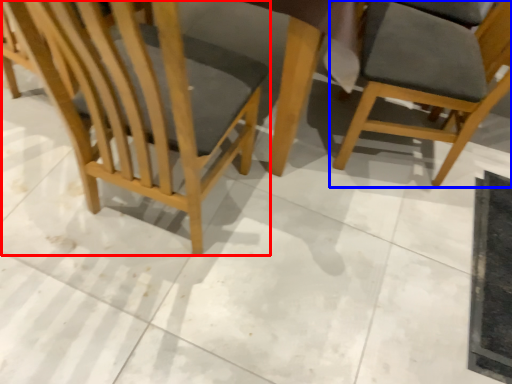
Question: Which object is further to the camera taking this photo, chair (highlighted by a red box) or chair (highlighted by a blue box)?

Choices:
 (A) chair
 (B) chair

Answer: (B)